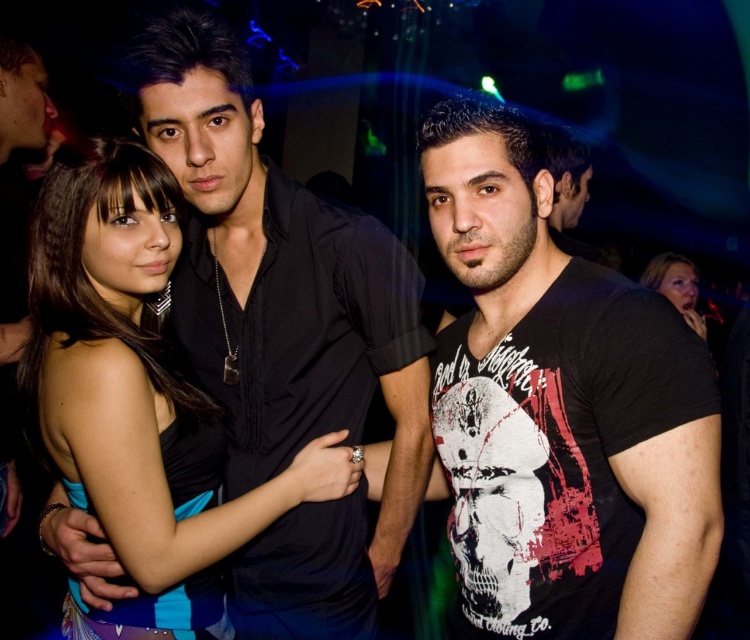
Which is above, matte black dress at center or smooth skin face at upper right?

smooth skin face at upper right is above.

Is matte black dress at center positioned in front of smooth skin face at upper right?

Yes, matte black dress at center is closer to the viewer.

Where is `matte black dress at center`? Image resolution: width=750 pixels, height=640 pixels. matte black dress at center is located at coordinates (140, 392).

Between black printed t-shirt at center and smooth skin face at upper right, which one has less height?

Standing shorter between the two is smooth skin face at upper right.

Between black printed t-shirt at center and smooth skin face at upper right, which one appears on the right side from the viewer's perspective?

Positioned to the right is smooth skin face at upper right.

Identify the location of black printed t-shirt at center. The width and height of the screenshot is (750, 640). (561, 410).

The width and height of the screenshot is (750, 640). Find the location of `black printed t-shirt at center`. black printed t-shirt at center is located at coordinates (561, 410).

Which of these two, black printed t-shirt at center or matte black dress at center, stands shorter?

Standing shorter between the two is matte black dress at center.

Measure the distance between point (555, 396) and camera.

The distance of point (555, 396) from camera is 3.51 feet.

Between point (672, 403) and point (123, 365), which one is positioned in front?

Point (672, 403) is more forward.

Locate an element on the screen. This screenshot has height=640, width=750. black printed t-shirt at center is located at coordinates (561, 410).